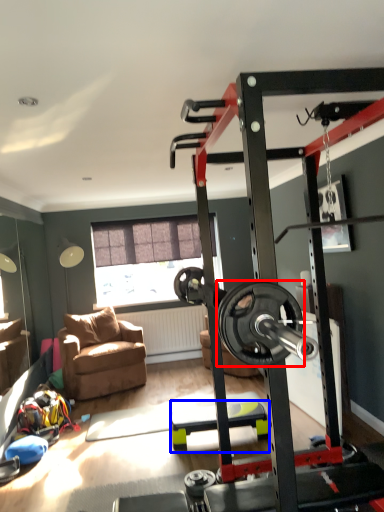
Question: Which object is further to the camera taking this photo, wheel (highlighted by a red box) or furniture (highlighted by a blue box)?

Choices:
 (A) wheel
 (B) furniture

Answer: (A)